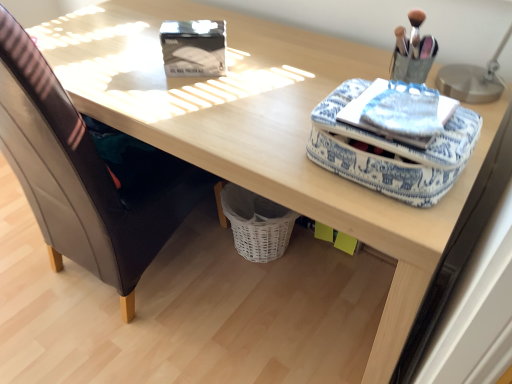
Find the location of a particular element. blue fabric case at upper right is located at coordinates (390, 151).

The image size is (512, 384). Describe the element at coordinates (84, 176) in the screenshot. I see `leather at left` at that location.

Looking at this image, in order to face blue printed fabric notepad at upper right, should I rotate leftwards or rightwards?

You should look right and rotate roughly 19.005 degrees.

Where is `matte black storage box at upper center`? The image size is (512, 384). matte black storage box at upper center is located at coordinates (194, 47).

Is blue fabric case at upper right not near metallic silver table lamp at upper right?

No, there isn't a large distance between blue fabric case at upper right and metallic silver table lamp at upper right.

Where is `material on the left of metallic silver table lamp at upper right`? The height and width of the screenshot is (384, 512). material on the left of metallic silver table lamp at upper right is located at coordinates (390, 151).

Is blue fabric case at upper right not within metallic silver table lamp at upper right?

Yes, blue fabric case at upper right is located beyond the bounds of metallic silver table lamp at upper right.

How far apart are blue fabric case at upper right and metallic silver table lamp at upper right?

blue fabric case at upper right and metallic silver table lamp at upper right are 11.65 inches apart.

From the picture: Is blue printed fabric notepad at upper right next to blue fabric case at upper right?

Yes, blue printed fabric notepad at upper right is in contact with blue fabric case at upper right.

Can you confirm if blue printed fabric notepad at upper right is wider than blue fabric case at upper right?

No, blue printed fabric notepad at upper right is not wider than blue fabric case at upper right.

Is blue printed fabric notepad at upper right inside the boundaries of blue fabric case at upper right, or outside?

blue printed fabric notepad at upper right is contained in blue fabric case at upper right.

How far apart are blue printed fabric notepad at upper right and blue fabric case at upper right?

blue printed fabric notepad at upper right is 1.69 inches away from blue fabric case at upper right.

From the image's perspective, is blue printed fabric notepad at upper right located above or below leather at left?

Clearly, from the image's perspective, blue printed fabric notepad at upper right is below leather at left.

Is blue printed fabric notepad at upper right completely or partially outside of leather at left?

Yes, blue printed fabric notepad at upper right is not within leather at left.

Which object is positioned more to the right, blue printed fabric notepad at upper right or leather at left?

blue printed fabric notepad at upper right.

Consider the image. From a real-world perspective, which object rests below the other?

In real-world perspective, leather at left is lower.

Considering the sizes of matte black storage box at upper center and metallic silver table lamp at upper right in the image, is matte black storage box at upper center bigger or smaller than metallic silver table lamp at upper right?

In the image, matte black storage box at upper center appears to be smaller than metallic silver table lamp at upper right.

From the picture: Between matte black storage box at upper center and metallic silver table lamp at upper right, which one has larger width?

Wider between the two is metallic silver table lamp at upper right.

Is point (218, 65) closer or farther from the camera than point (489, 91)?

Clearly, point (218, 65) is more distant from the camera than point (489, 91).

From the image's perspective, is matte black storage box at upper center beneath metallic silver table lamp at upper right?

Incorrect, from the image's perspective, matte black storage box at upper center is higher than metallic silver table lamp at upper right.

Is the depth of metallic silver table lamp at upper right less than that of blue fabric case at upper right?

That is False.

Based on the photo, which of these two, metallic silver table lamp at upper right or blue fabric case at upper right, is wider?

blue fabric case at upper right.

Between point (471, 73) and point (330, 153), which one is positioned in front?

The point (330, 153) is more forward.

Does metallic silver table lamp at upper right have a larger size compared to blue fabric case at upper right?

Yes.

Which is closer to the camera, (x=71, y=227) or (x=458, y=64)?

The point (x=458, y=64) is more forward.

Considering the sizes of objects leather at left and metallic silver table lamp at upper right in the image provided, who is bigger, leather at left or metallic silver table lamp at upper right?

leather at left is bigger.

Which object is more forward, blue printed fabric notepad at upper right or matte black storage box at upper center?

blue printed fabric notepad at upper right is more forward.

Is matte black storage box at upper center a part of blue printed fabric notepad at upper right?

Definitely not — matte black storage box at upper center is not inside blue printed fabric notepad at upper right.

How many degrees apart are the facing directions of blue printed fabric notepad at upper right and matte black storage box at upper center?

The angular difference between blue printed fabric notepad at upper right and matte black storage box at upper center is 30.1 degrees.

Considering the relative sizes of blue printed fabric notepad at upper right and matte black storage box at upper center in the image provided, is blue printed fabric notepad at upper right wider than matte black storage box at upper center?

Indeed, blue printed fabric notepad at upper right has a greater width compared to matte black storage box at upper center.

At what (x,y) coordinates should I click in order to perform the action: click on material below the metallic silver table lamp at upper right (from the image's perspective). Please return your answer as a coordinate pair (x, y). Looking at the image, I should click on tap(390, 151).

I want to click on material located underneath the blue printed fabric notepad at upper right (from a real-world perspective), so click(390, 151).

Looking at the image, which one is located closer to matte black storage box at upper center, blue fabric case at upper right or blue printed fabric notepad at upper right?

blue fabric case at upper right is closer to matte black storage box at upper center.

Estimate the real-world distances between objects in this image. Which object is closer to matte black storage box at upper center, blue printed fabric notepad at upper right or leather at left?

blue printed fabric notepad at upper right is closer to matte black storage box at upper center.

Looking at the image, which one is located further to leather at left, matte black storage box at upper center or blue fabric case at upper right?

blue fabric case at upper right.

Considering their positions, is blue fabric case at upper right positioned further to leather at left than matte black storage box at upper center?

blue fabric case at upper right is further to leather at left.

When comparing their distances from metallic silver table lamp at upper right, does blue fabric case at upper right or matte black storage box at upper center seem further?

matte black storage box at upper center is positioned further to the anchor metallic silver table lamp at upper right.

Considering their positions, is matte black storage box at upper center positioned closer to metallic silver table lamp at upper right than blue fabric case at upper right?

Based on the image, blue fabric case at upper right appears to be nearer to metallic silver table lamp at upper right.

Considering their positions, is leather at left positioned closer to matte black storage box at upper center than blue printed fabric notepad at upper right?

blue printed fabric notepad at upper right is positioned closer to the anchor matte black storage box at upper center.

In the scene shown: Estimate the real-world distances between objects in this image. Which object is closer to metallic silver table lamp at upper right, matte black storage box at upper center or leather at left?

Among the two, matte black storage box at upper center is located nearer to metallic silver table lamp at upper right.

At what (x,y) coordinates should I click in order to perform the action: click on notepad between leather at left and metallic silver table lamp at upper right. Please return your answer as a coordinate pair (x, y). The image size is (512, 384). Looking at the image, I should click on (362, 109).

You are a GUI agent. You are given a task and a screenshot of the screen. Output one action in this format:
    pyautogui.click(x=<x>, y=<y>)
    Task: Click on the storage box between leather at left and blue fabric case at upper right
    The image size is (512, 384).
    Given the screenshot: What is the action you would take?
    pyautogui.click(x=194, y=47)

Locate an element on the screen. Image resolution: width=512 pixels, height=384 pixels. notepad situated between matte black storage box at upper center and metallic silver table lamp at upper right from left to right is located at coordinates (362, 109).

Identify the location of storage box between leather at left and blue printed fabric notepad at upper right from left to right. This screenshot has height=384, width=512. (194, 47).